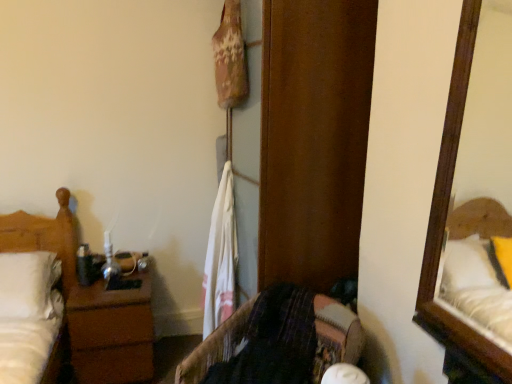
Question: From a real-world perspective, relative to velvet-like fabric chair at center, is white cotton towel at center vertically above or below?

Choices:
 (A) above
 (B) below

Answer: (A)

Question: Is white cotton towel at center inside the boundaries of velvet-like fabric chair at center, or outside?

Choices:
 (A) inside
 (B) outside

Answer: (B)

Question: Which is farther from the white cotton towel at center?

Choices:
 (A) white matte bed at left
 (B) brown wood nightstand at left
 (C) velvet-like fabric chair at center

Answer: (A)

Question: Estimate the real-world distances between objects in this image. Which object is closer to the white matte bed at left?

Choices:
 (A) white cotton towel at center
 (B) velvet-like fabric chair at center
 (C) brown wood nightstand at left

Answer: (C)